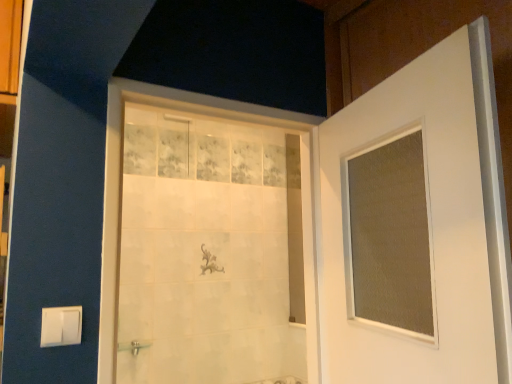
Question: Should I look upward or downward to see white matte door at center?

Choices:
 (A) up
 (B) down

Answer: (B)